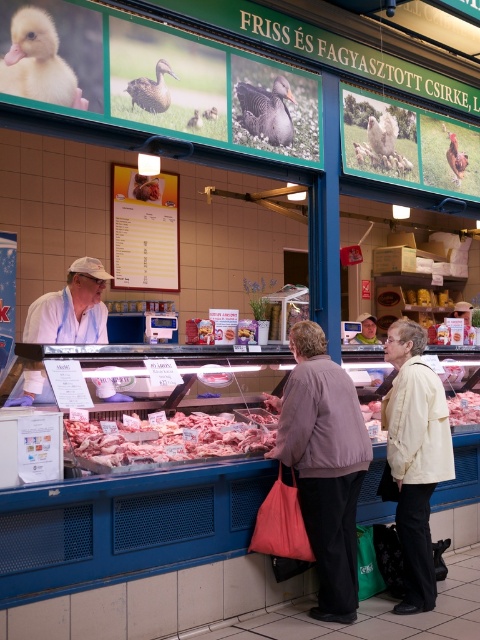
Question: Among these objects, which one is farthest from the camera?

Choices:
 (A) pink glossy meat at center
 (B) pinkish raw meat at center
 (C) light beige jacket at lower right
 (D) light beige jacket at center

Answer: (A)

Question: Can you confirm if light beige jacket at center is thinner than pink glossy meat at center?

Choices:
 (A) no
 (B) yes

Answer: (A)

Question: Which point is closer to the camera?

Choices:
 (A) light beige jacket at center
 (B) pinkish raw meat at center
 (C) pink glossy meat at center

Answer: (B)

Question: Can you confirm if light beige jacket at center is wider than pink glossy meat at center?

Choices:
 (A) no
 (B) yes

Answer: (B)

Question: Does light beige jacket at lower right appear on the left side of pinkish raw meat at center?

Choices:
 (A) yes
 (B) no

Answer: (B)

Question: Which point is farther from the camera taking this photo?

Choices:
 (A) 420,348
 (B) 466,420
 (C) 352,544
 (D) 218,417

Answer: (B)